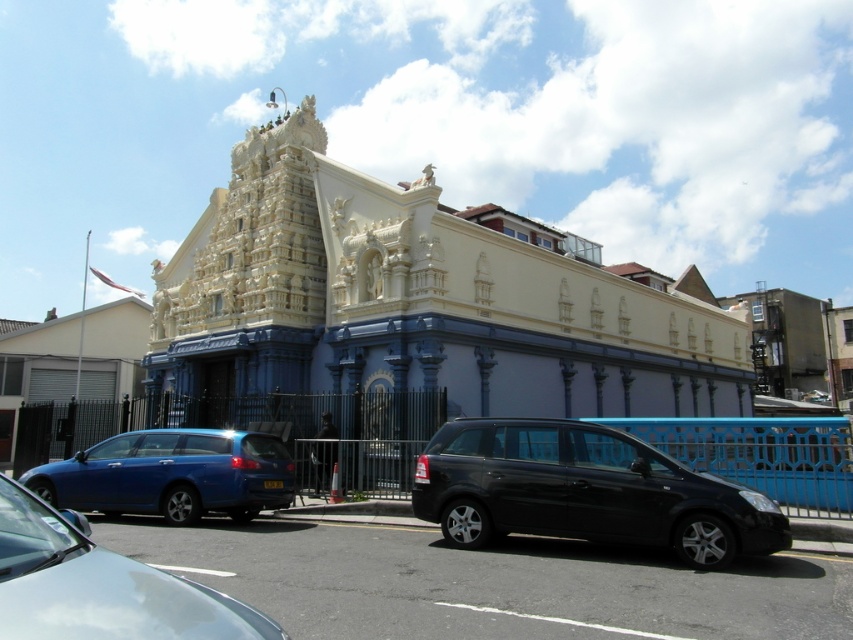
You are standing at the entrance of the temple and want to take a photo of the black matte van at center. Where should you position yourself to capture the van in the frame?

To capture the black matte van at center in the frame, position yourself at the entrance and aim your camera towards the center of the scene, as the van is located at the central point of the image.

You are a delivery driver who needs to park your vehicle in the parking lot near the temple. You have a truck that is 20 feet long. There is a black matte van at center and a metallic blue station wagon at lower left. Can you safely park your truck between these two vehicles without overlapping them?

The black matte van at center is 42.43 feet away from the metallic blue station wagon at lower left. Since your truck is only 20 feet long, there is enough space between them to park safely without overlapping.

You are standing at the entrance of the park and want to visit the white stone hindu temple at center. According to the map, your current position is at point 0.5, 0.5. Can you walk directly towards the temple from your current position?

The white stone hindu temple at center is located at point (418, 300). Since your current position is at (426, 320), you are very close to the temple and can walk directly towards it.